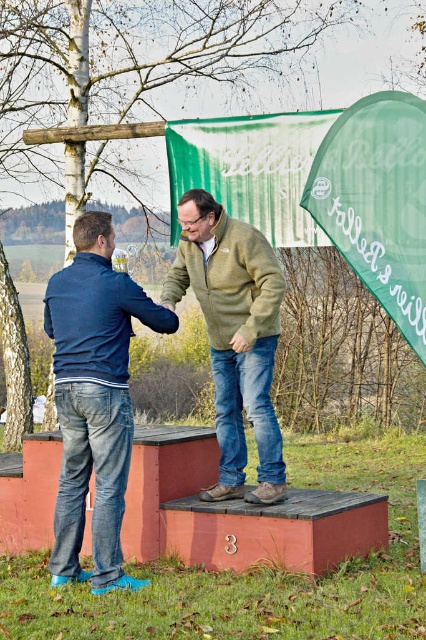
You are a photographer positioned at point (108, 326). You want to take a photo of the two people on the podium. Since they are 6.77 meters apart, will you need to zoom in or out to ensure both are in frame?

Since the two people are 6.77 meters apart, you will need to zoom out to ensure both are in frame.

You are a photographer setting up a tripod in front of the podium. You notice the blue denim jeans at lower left and the green fuzzy sweater at center. Which clothing item should you adjust your camera angle to focus on if you want to capture the wider object?

The blue denim jeans at lower left are wider than the green fuzzy sweater at center, so you should adjust your camera angle to focus on the blue denim jeans at lower left to capture the wider object.

You are a photographer standing behind the two people on the podium. You want to capture a photo where both the blue denim jeans at lower left and the green fuzzy sweater at center are in focus. Given that your camera can only focus on objects within a 30 inch range, will you be able to achieve this?

The distance between the blue denim jeans at lower left and the green fuzzy sweater at center is 28.76 inches, which is within the 30 inch range of your camera. Therefore, you can achieve focus on both objects.